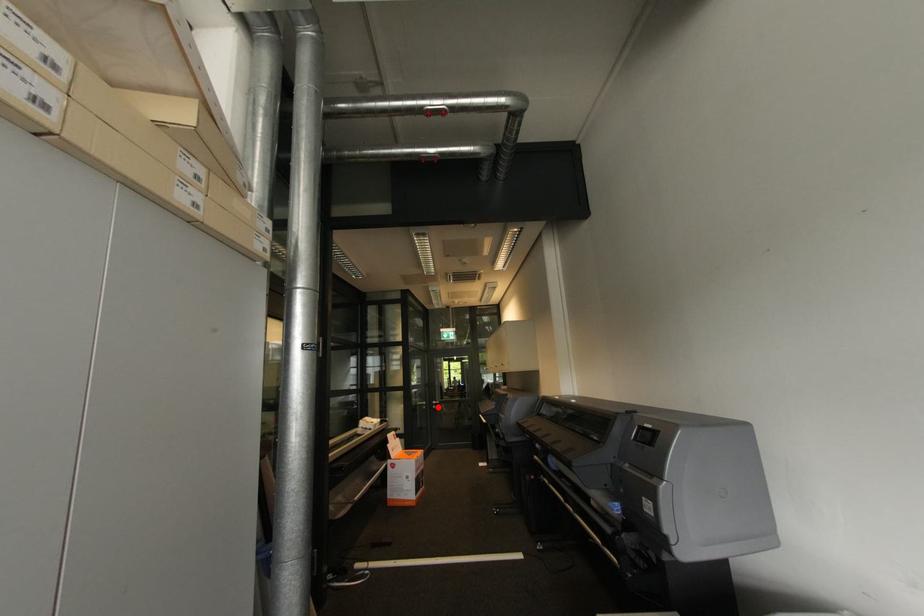
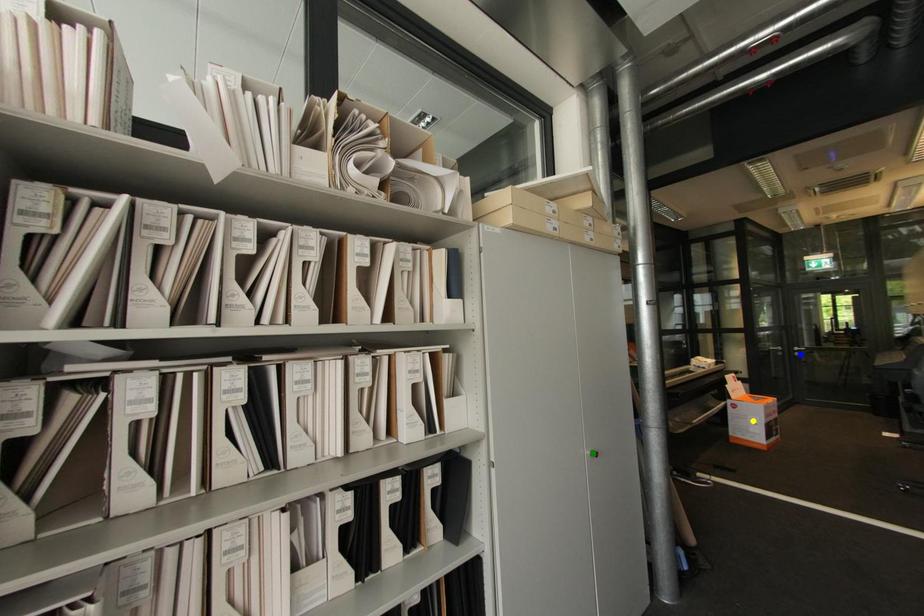
Question: I am providing you with two images of the same scene from different viewpoints. A red point is marked on the first image. You are given multiple points on the second image. Can you choose the point in image 2 that corresponds to the point in image 1?

Choices:
 (A) yellow point
 (B) blue point
 (C) green point

Answer: (B)